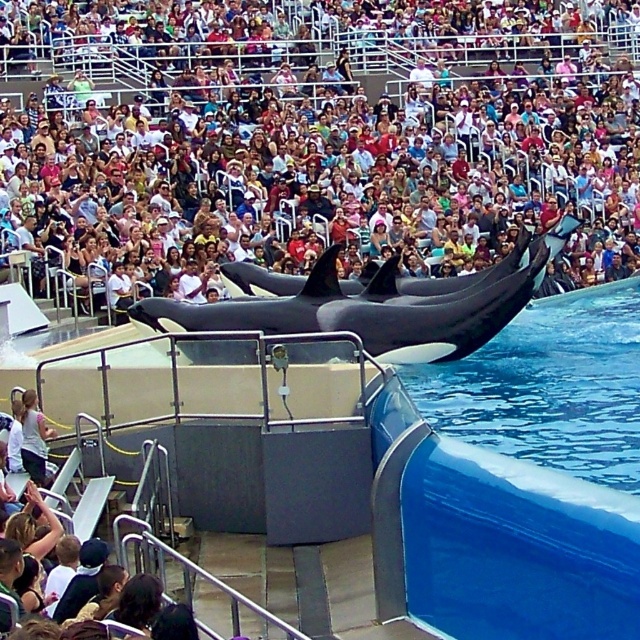
You are a photographer at the marine show. You want to capture a photo of the matte black orca at center without any distractions from the light pink fabric shirt at lower left. Based on their positions, can you frame the shot so the orca is visible but the shirt is not?

The matte black orca at center is positioned over light pink fabric shirt at lower left, so if you angle your camera to focus on the orca above, you can exclude the shirt from the frame by adjusting the shot to capture only the area where the orca is leaping, excluding the lower left corner where the shirt is located.

Based on the photo, you are a photographer standing at the front row of the marine show. You want to take a photo of both the point at coordinates point [54,125] and point [426,449] in the scene. Which point will appear closer to you in your camera view?

Point [54,125] is further to the camera than point [426,449], so in your camera view, point [426,449] will appear closer to you because it is nearer to the camera position.

You are a photographer standing at the edge of the bleachers, trying to capture the killer whales performing. You notice two points in the scene marked as point 1 and point 2. If point 1 is located at coordinate point (80, 1) and point 2 is at (29, 420), which point is closer to you?

Point 1 at coordinate point (80, 1) is closer to you since it is further to the viewer than point 2 at (29, 420).